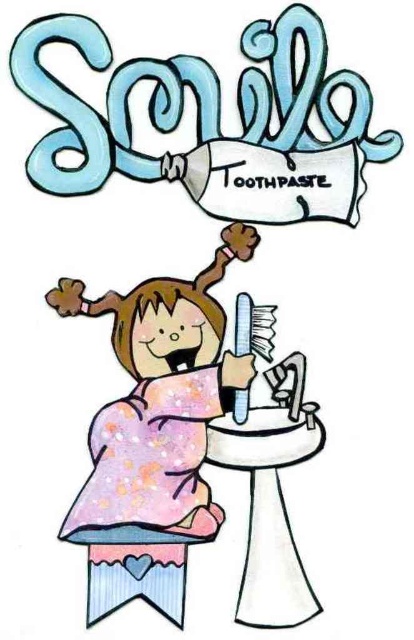
You are a photographer trying to capture the best angle of the girl holding the toothbrush. You notice two points marked on your camera screen at coordinates point (124, 404) and point (238, 404). Which point is closer to your camera lens?

Point (124, 404) is closer to the camera lens than point (238, 404).

You are a child who wants to reach the toothbrush on the white glossy sink at center. You are sitting on the pastel fabric stool at lower center. Can you easily reach the sink?

The white glossy sink at center is taller than the pastel fabric stool at lower center, so you may need to stand up or get a step stool to reach the toothbrush on the sink.

In the dental hygiene scene, there is a pastel glitter dress at center and a white glossy sink at center. From the perspective of someone facing the image, which object is positioned to the left?

The pastel glitter dress at center is positioned to the left of the white glossy sink at center.